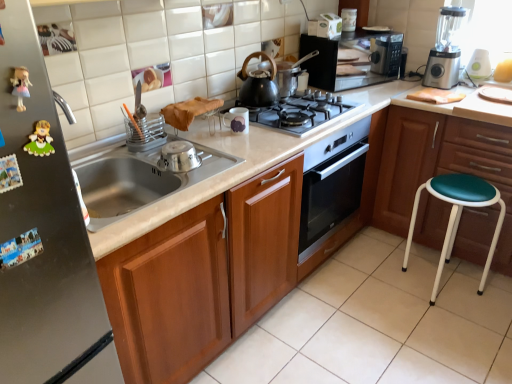
Find the location of a particular element. vacant space behind stainless steel bowl at sink, the third appliance when ordered from right to left is located at coordinates (213, 145).